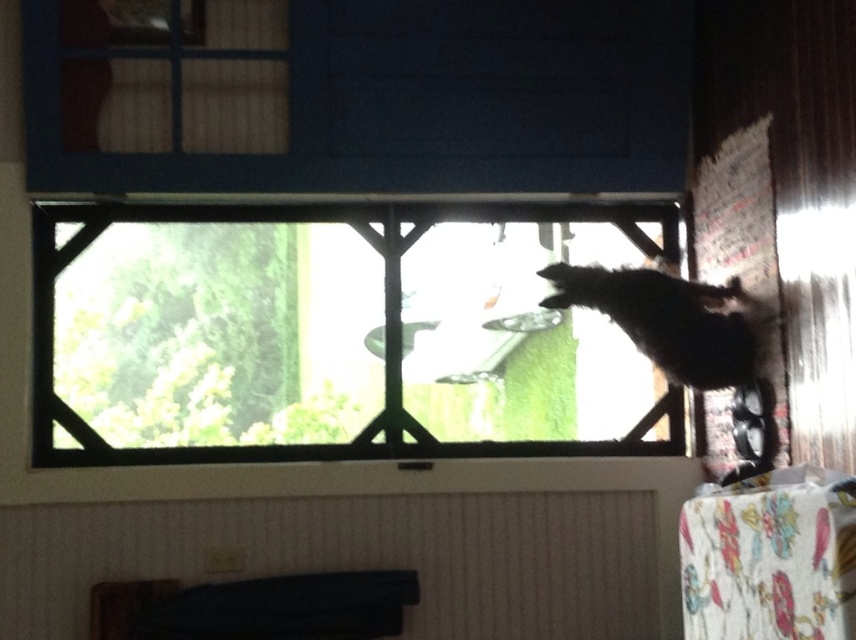
Question: Is clear glass window at center thinner than black fabric at lower center?

Choices:
 (A) yes
 (B) no

Answer: (B)

Question: Which point is farther to the camera?

Choices:
 (A) (256, 531)
 (B) (815, 400)

Answer: (A)

Question: Does white paper at right appear on the right side of black fur cat at right?

Choices:
 (A) no
 (B) yes

Answer: (B)

Question: Is clear glass window at center smaller than black fabric at lower center?

Choices:
 (A) yes
 (B) no

Answer: (B)

Question: Which object is farther from the camera taking this photo?

Choices:
 (A) white paper at right
 (B) black fabric at lower center

Answer: (B)

Question: Which point appears closest to the camera in this image?

Choices:
 (A) (525, 355)
 (B) (807, 65)
 (C) (571, 296)

Answer: (B)